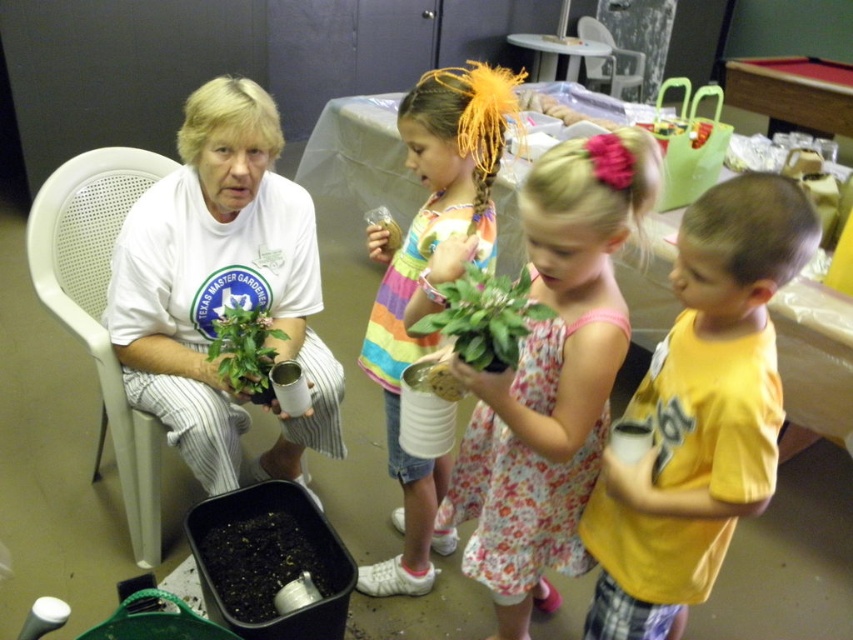
Is floral dress at center below green matte plant at left?

Correct, floral dress at center is located below green matte plant at left.

Which is behind, point (540, 212) or point (257, 349)?

Point (257, 349)

Is point (558, 490) positioned behind point (276, 330)?

No.

At what (x,y) coordinates should I click in order to perform the action: click on floral dress at center. Please return your answer as a coordinate pair (x, y). This screenshot has width=853, height=640. Looking at the image, I should click on (548, 385).

From the picture: Is floral dress at center thinner than pink fabric flower at upper center?

Incorrect, floral dress at center's width is not less than pink fabric flower at upper center's.

You are a GUI agent. You are given a task and a screenshot of the screen. Output one action in this format:
    pyautogui.click(x=<x>, y=<y>)
    Task: Click on the floral dress at center
    The height and width of the screenshot is (640, 853).
    Given the screenshot: What is the action you would take?
    pyautogui.click(x=548, y=385)

Identify the location of floral dress at center. The width and height of the screenshot is (853, 640). (548, 385).

I want to click on floral dress at center, so click(x=548, y=385).

Locate an element on the screen. yellow cotton shirt at center is located at coordinates (700, 412).

Does yellow cotton shirt at center have a greater height compared to pink fabric flower at upper center?

Indeed, yellow cotton shirt at center has a greater height compared to pink fabric flower at upper center.

Measure the distance between point (x=804, y=252) and camera.

A distance of 37.63 inches exists between point (x=804, y=252) and camera.

Where is `yellow cotton shirt at center`? The image size is (853, 640). yellow cotton shirt at center is located at coordinates (700, 412).